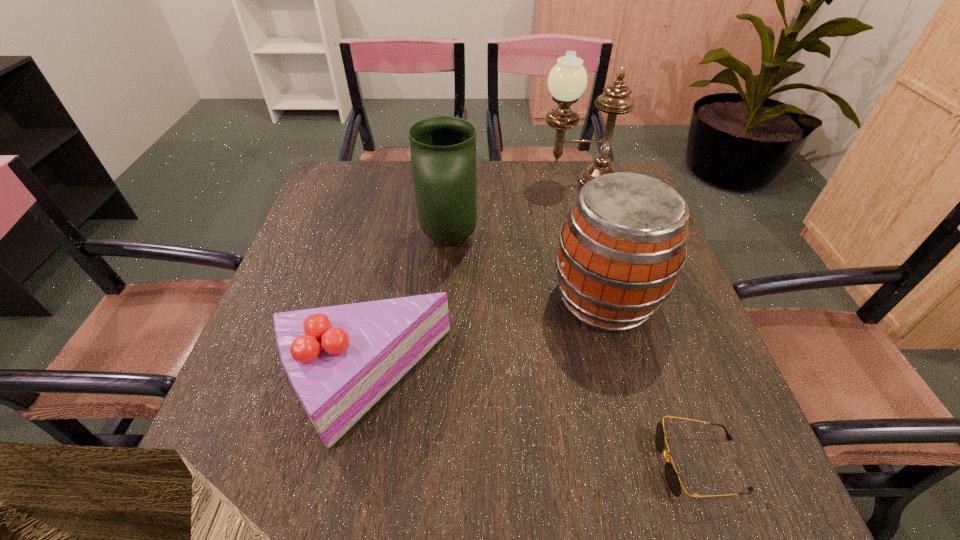
In order to click on vacant area situated on the front-facing side of the sunglasses in this screenshot , I will do `click(568, 464)`.

Locate an element on the screen. vacant space located 0.100m on the front-facing side of the sunglasses is located at coordinates (598, 464).

I want to click on vacant region located on the front-facing side of the sunglasses, so 568,464.

Identify the location of object positioned at the far edge. This screenshot has height=540, width=960. (567, 80).

Identify the location of object at the near edge. Image resolution: width=960 pixels, height=540 pixels. (672, 477).

Where is `object situated at the left edge`? The width and height of the screenshot is (960, 540). object situated at the left edge is located at coordinates (340, 360).

This screenshot has height=540, width=960. Identify the location of oil lamp situated at the right edge. (567, 80).

Identify the location of cider at the right edge. [x=623, y=244].

Identify the location of sunglasses that is positioned at the right edge. (672, 477).

Identify the location of object present at the far right corner. This screenshot has width=960, height=540. (567, 80).